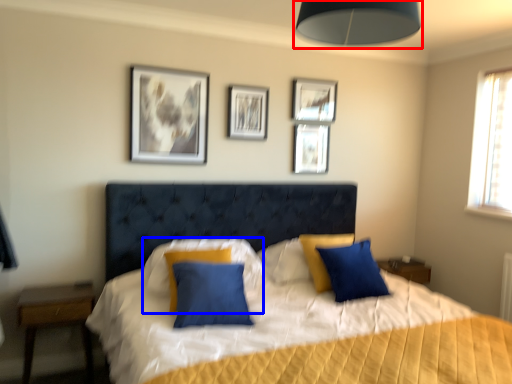
Question: Which object appears farthest to the camera in this image, lamp (highlighted by a red box) or pillow (highlighted by a blue box)?

Choices:
 (A) lamp
 (B) pillow

Answer: (B)